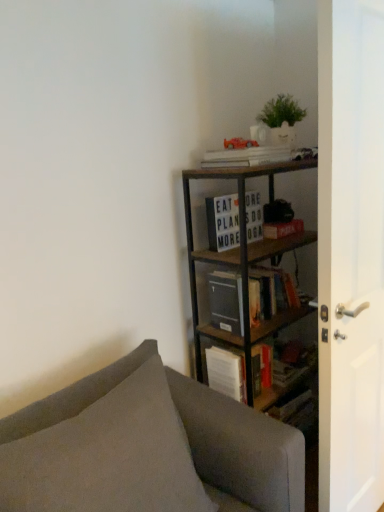
Question: Does point (241, 180) appear closer or farther from the camera than point (261, 150)?

Choices:
 (A) closer
 (B) farther

Answer: (B)

Question: Looking at their shapes, would you say metallic brown bookcase at upper right is wider or thinner than white matte book at upper center, positioned as the 1th book in top-to-bottom order?

Choices:
 (A) thin
 (B) wide

Answer: (B)

Question: Which object is the closest to the metallic brown bookcase at upper right?

Choices:
 (A) white matte paperback book at upper center
 (B) white glossy door at right
 (C) white matte book at upper center, the 3th book when ordered from bottom to top
 (D) gray fabric couch at lower left
 (E) white matte signboard at upper center, placed as the second book when sorted from top to bottom

Answer: (E)

Question: Considering the real-world distances, which object is farthest from the gray fabric couch at lower left?

Choices:
 (A) white matte paperback book at upper center
 (B) white matte book at upper center, the 3th book when ordered from bottom to top
 (C) metallic brown bookcase at upper right
 (D) matte black book at center, the third book when ordered from top to bottom
 (E) white glossy door at right

Answer: (B)